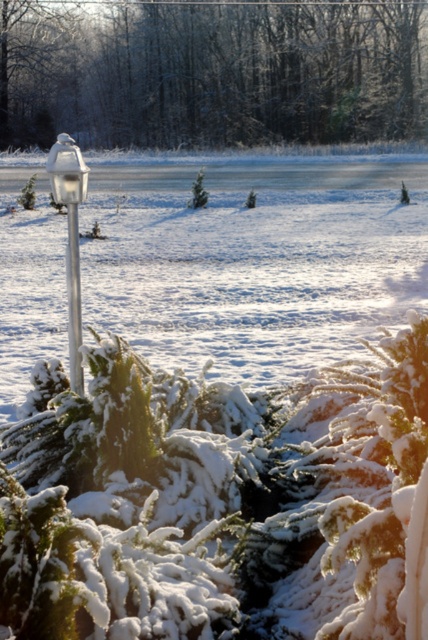
Question: Which of the following is the closest to the observer?

Choices:
 (A) snow-covered evergreen at center
 (B) metallic pole at left

Answer: (B)

Question: Considering the relative positions of snow-covered evergreen at center and metallic pole at left in the image provided, where is snow-covered evergreen at center located with respect to metallic pole at left?

Choices:
 (A) below
 (B) above

Answer: (B)

Question: Is snow-covered evergreen at center bigger than metallic pole at left?

Choices:
 (A) no
 (B) yes

Answer: (B)

Question: Among these points, which one is farthest from the camera?

Choices:
 (A) (80, 369)
 (B) (419, 72)

Answer: (B)

Question: Observing the image, what is the correct spatial positioning of snow-covered evergreen at center in reference to metallic pole at left?

Choices:
 (A) right
 (B) left

Answer: (A)